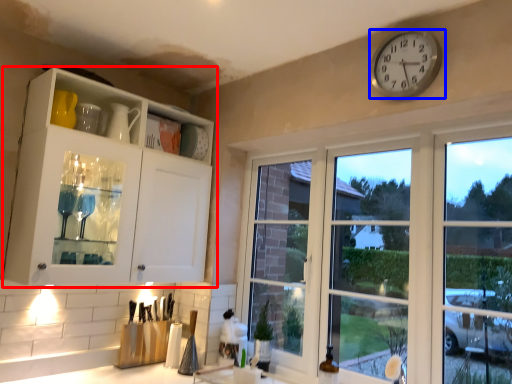
Question: Which of the following is the farthest to the observer, cabinetry (highlighted by a red box) or wall clock (highlighted by a blue box)?

Choices:
 (A) cabinetry
 (B) wall clock

Answer: (A)